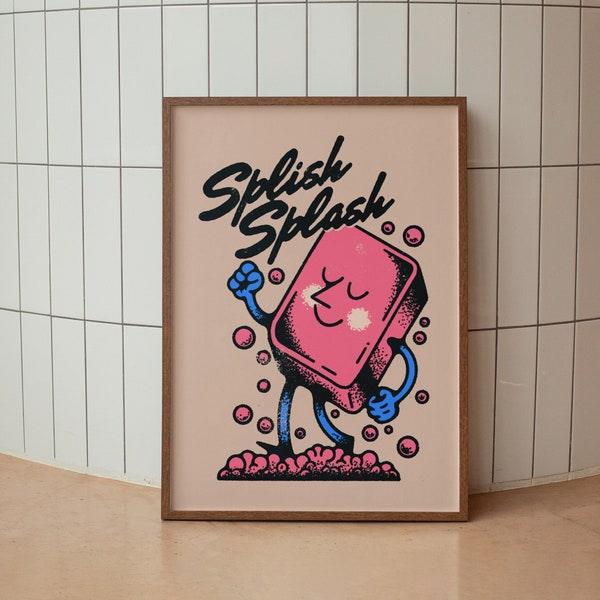
Where is `white tile`? This screenshot has width=600, height=600. white tile is located at coordinates (71, 230), (518, 255).